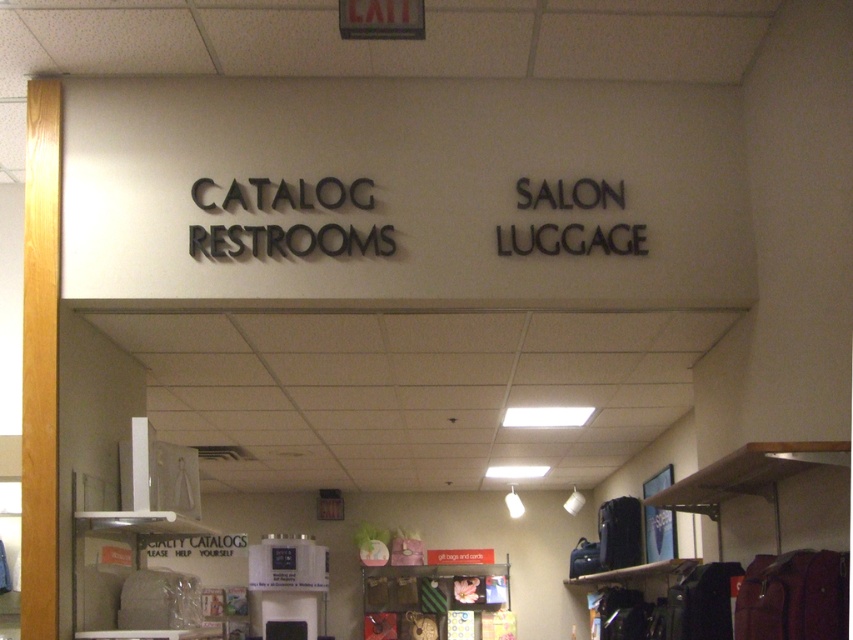
Question: Which object appears farthest from the camera in this image?

Choices:
 (A) black metallic sign at upper right
 (B) black matte sign at center

Answer: (A)

Question: Can you confirm if matte black wallet at center is positioned above black metallic sign at upper right?

Choices:
 (A) no
 (B) yes

Answer: (A)

Question: Which of these objects is positioned closest to the black matte sign at center?

Choices:
 (A) matte black wallet at center
 (B) black metallic sign at upper right

Answer: (B)

Question: Based on their relative distances, which object is farther from the black metallic sign at upper right?

Choices:
 (A) matte black wallet at center
 (B) black matte sign at center

Answer: (A)

Question: Does matte black wallet at center appear under black metallic sign at upper right?

Choices:
 (A) no
 (B) yes

Answer: (B)

Question: Does matte black wallet at center have a greater width compared to black metallic sign at upper right?

Choices:
 (A) yes
 (B) no

Answer: (A)